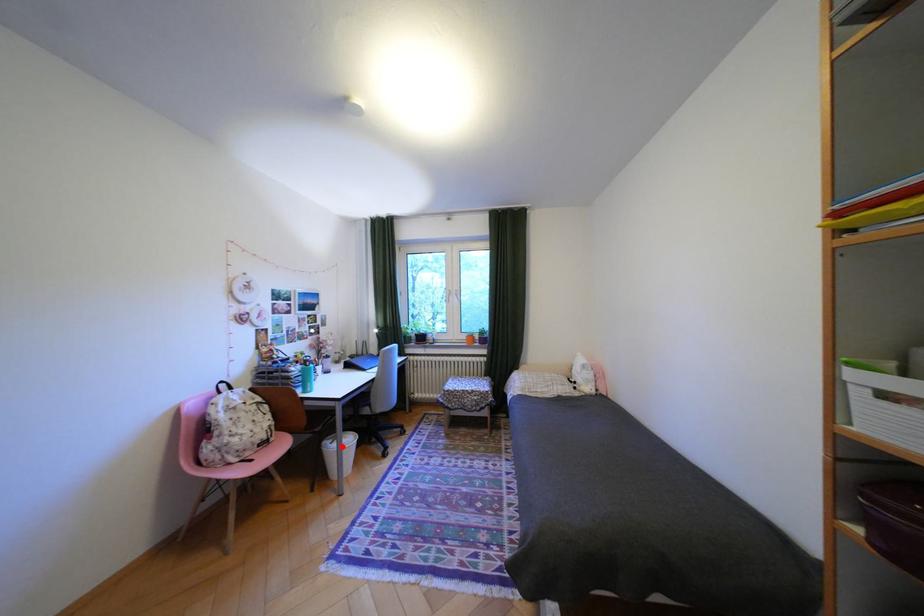
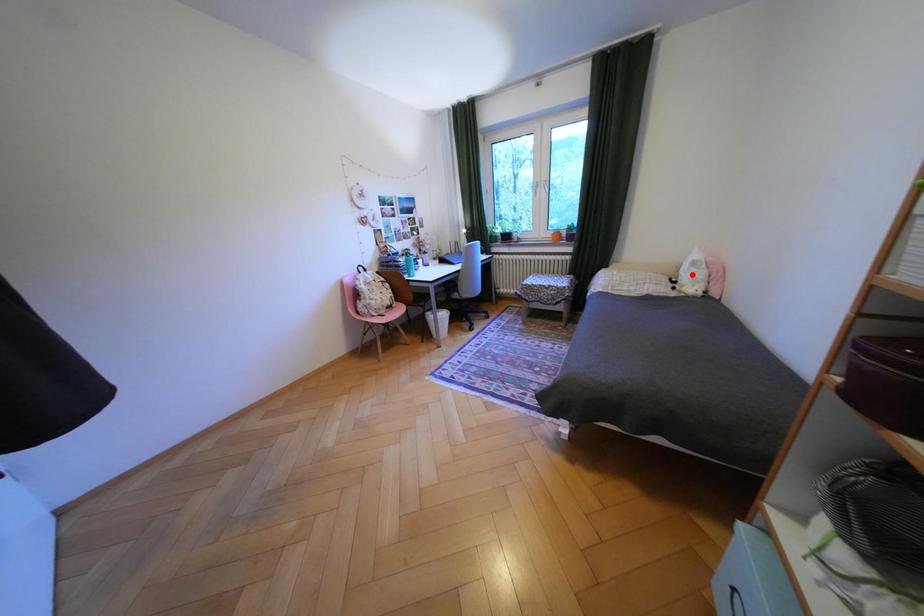
I am providing you with two images of the same scene from different viewpoints. A red point is marked on the first image and another point is marked on the second image. Is the marked point in image1 the same physical position as the marked point in image2?

No